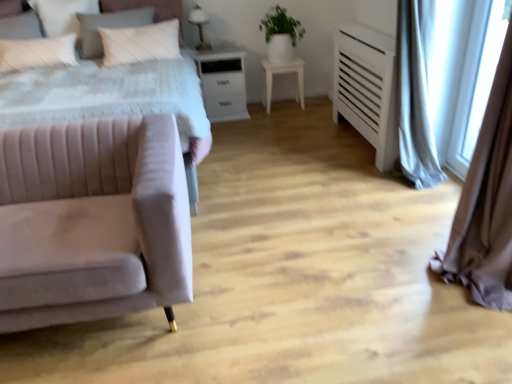
The image size is (512, 384). In order to click on vacant area that lies between white glossy nightstand at center and white matte table at center in this screenshot , I will do `click(263, 111)`.